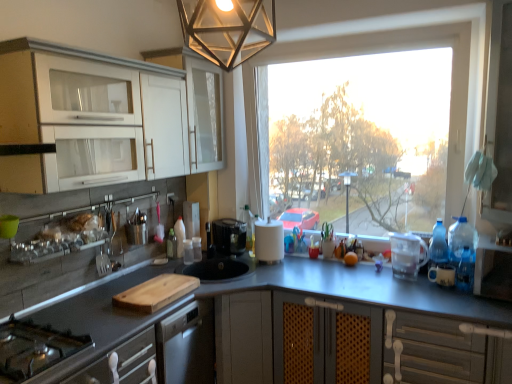
Question: Considering the positions of point (353, 258) and point (183, 291), is point (353, 258) closer or farther from the camera than point (183, 291)?

Choices:
 (A) farther
 (B) closer

Answer: (A)

Question: Would you say orange matte at counter is inside or outside wooden cutting board at center?

Choices:
 (A) outside
 (B) inside

Answer: (A)

Question: Which object is the closest to the blue translucent bottle at right, placed as the 4th bottle when sorted from left to right?

Choices:
 (A) translucent plastic bottle at center, which is the fourth bottle from front to back
 (B) orange matte at counter
 (C) wooden cutting board at center
 (D) white glossy cabinet at upper left, which is the 2th cabinetry from back to front
 (E) satin silver cutlery at left

Answer: (B)

Question: Based on their relative distances, which object is nearer to the translucent plastic bottle at center, the 3th bottle viewed from the front?

Choices:
 (A) transparent plastic container at right, which is the 3th appliance in right-to-left order
 (B) transparent glass window at center
 (C) black plastic coffee machine at center
 (D) white plastic screen door at right
 (E) white glossy cabinet at upper left, which is the 2th cabinetry from back to front

Answer: (C)